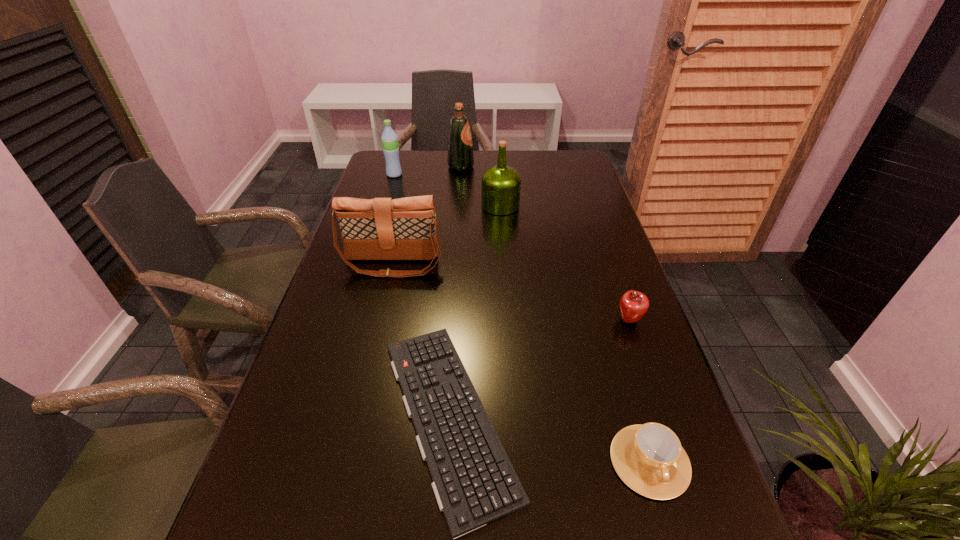
Identify the location of unoccupied position between the water bottle and the left olive oil. This screenshot has height=540, width=960. (427, 171).

This screenshot has height=540, width=960. I want to click on vacant region between the water bottle and the computer keyboard, so click(x=421, y=295).

The width and height of the screenshot is (960, 540). I want to click on empty location between the sixth tallest object and the farther olive oil, so [x=555, y=314].

Locate an element on the screen. The width and height of the screenshot is (960, 540). free space between the fifth farthest object and the shoulder bag is located at coordinates (511, 292).

Point out which object is positioned as the second nearest to the farther olive oil. Please provide its 2D coordinates. Your answer should be formatted as a tuple, i.e. [(x, y)], where the tuple contains the x and y coordinates of a point satisfying the conditions above.

[(389, 138)]

Identify which object is the nearest to the fifth farthest object. Please provide its 2D coordinates. Your answer should be formatted as a tuple, i.e. [(x, y)], where the tuple contains the x and y coordinates of a point satisfying the conditions above.

[(475, 483)]

Where is `vacant point that satisfies the following two spatial constraints: 1. on the front-facing side of the nearer olive oil; 2. on the left side of the left olive oil`? vacant point that satisfies the following two spatial constraints: 1. on the front-facing side of the nearer olive oil; 2. on the left side of the left olive oil is located at coordinates (458, 205).

Where is `vacant area that satisfies the following two spatial constraints: 1. on the front-facing side of the left olive oil; 2. on the right side of the third shortest object`? The image size is (960, 540). vacant area that satisfies the following two spatial constraints: 1. on the front-facing side of the left olive oil; 2. on the right side of the third shortest object is located at coordinates (450, 320).

The height and width of the screenshot is (540, 960). Identify the location of vacant region that satisfies the following two spatial constraints: 1. on the front-facing side of the farther olive oil; 2. on the right side of the third farthest object. (458, 205).